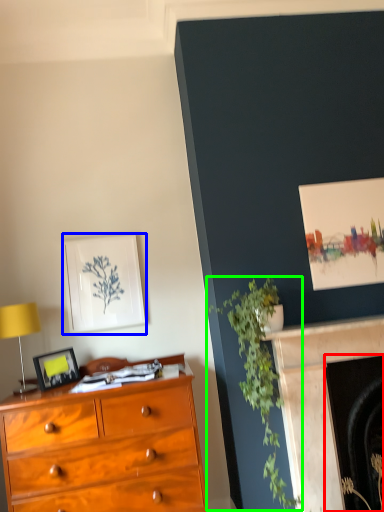
Question: Estimate the real-world distances between objects in this image. Which object is farther from fireplace (highlighted by a red box), picture frame (highlighted by a blue box) or plant (highlighted by a green box)?

Choices:
 (A) picture frame
 (B) plant

Answer: (A)